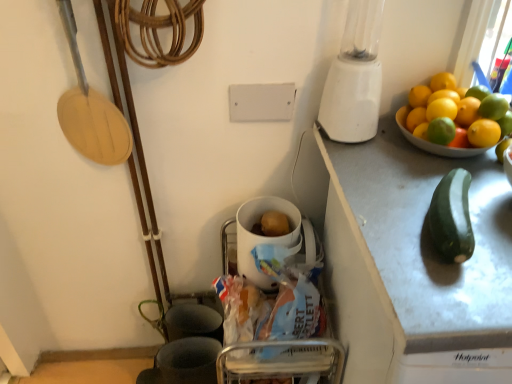
The width and height of the screenshot is (512, 384). What are the coordinates of `vacant space that is to the left of yellow matte lemon at upper right, the 3th lemon viewed from the top` in the screenshot? It's located at (378, 158).